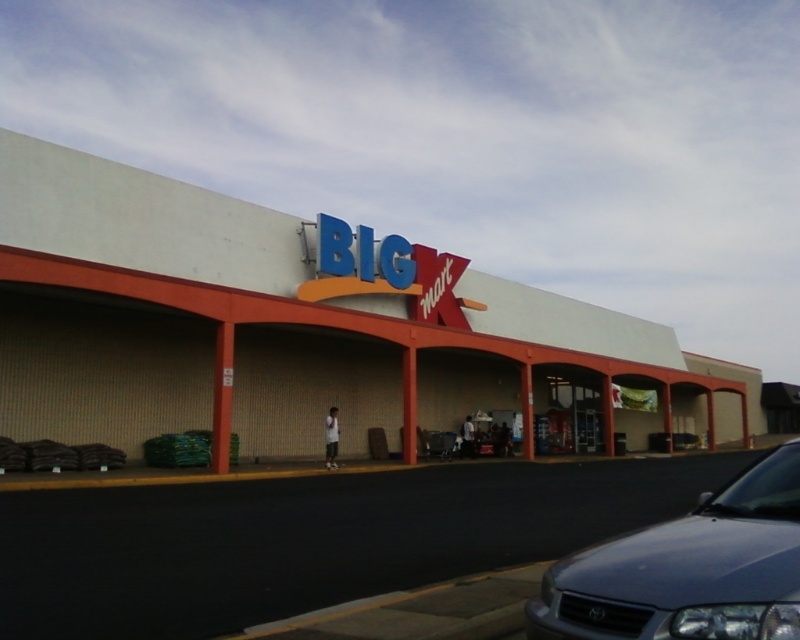
Question: Can you confirm if white concrete mall at center is positioned below satin silver sedan at lower right?

Choices:
 (A) yes
 (B) no

Answer: (B)

Question: Which of the following is the farthest from the observer?

Choices:
 (A) (34, 380)
 (B) (744, 620)

Answer: (A)

Question: Can you confirm if white concrete mall at center is positioned to the right of satin silver sedan at lower right?

Choices:
 (A) yes
 (B) no

Answer: (A)

Question: Which of the following is the closest to the observer?

Choices:
 (A) (741, 609)
 (B) (429, 385)

Answer: (A)

Question: Is white concrete mall at center to the left of satin silver sedan at lower right from the viewer's perspective?

Choices:
 (A) no
 (B) yes

Answer: (A)

Question: Which object appears closest to the camera in this image?

Choices:
 (A) satin silver sedan at lower right
 (B) white concrete mall at center

Answer: (A)